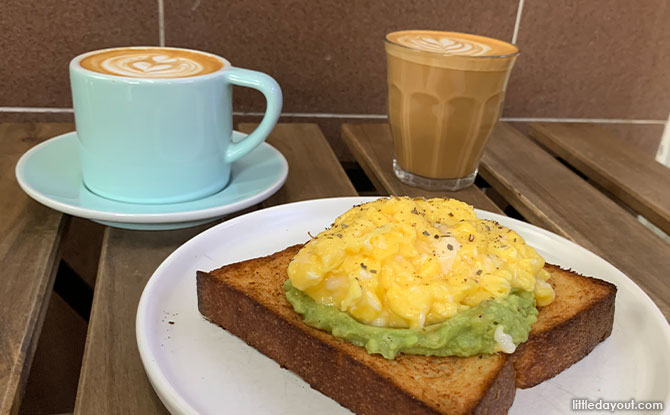
This screenshot has width=670, height=415. I want to click on clear glass, so click(x=449, y=122).